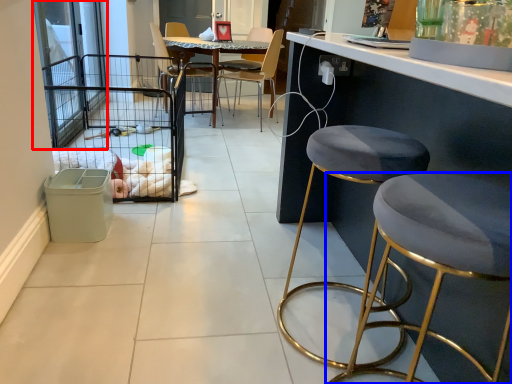
Question: Which object appears farthest to the camera in this image, screen door (highlighted by a red box) or stool (highlighted by a blue box)?

Choices:
 (A) screen door
 (B) stool

Answer: (A)